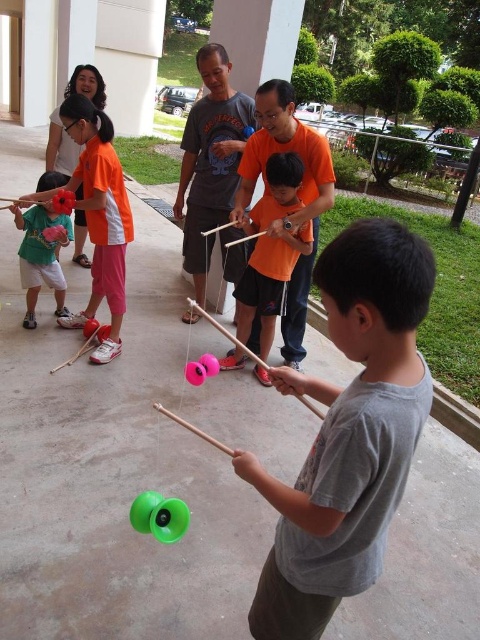
Is orange cotton shirt at upper left smaller than matte pink yo-yo at center?

No, orange cotton shirt at upper left is not smaller than matte pink yo-yo at center.

Does point (80, 125) come farther from viewer compared to point (74, 200)?

No, it is in front of (74, 200).

At what (x,y) coordinates should I click in order to perform the action: click on orange cotton shirt at upper left. Please return your answer as a coordinate pair (x, y). This screenshot has height=640, width=480. Looking at the image, I should click on (99, 216).

Who is lower down, gray matte shirt at center or orange cotton shirt at upper left?

gray matte shirt at center is below.

Who is higher up, gray matte shirt at center or orange cotton shirt at upper left?

orange cotton shirt at upper left is higher up.

Is point (269, 600) behind point (20, 196)?

No, (269, 600) is in front of (20, 196).

The height and width of the screenshot is (640, 480). I want to click on gray matte shirt at center, so click(x=348, y=433).

Which is more to the left, orange cotton shirt at upper left or pink rubber yo-yo at center?

orange cotton shirt at upper left is more to the left.

Who is lower down, orange cotton shirt at upper left or pink rubber yo-yo at center?

pink rubber yo-yo at center

Describe the element at coordinates (99, 216) in the screenshot. I see `orange cotton shirt at upper left` at that location.

Find the location of a particular element. orange cotton shirt at upper left is located at coordinates (99, 216).